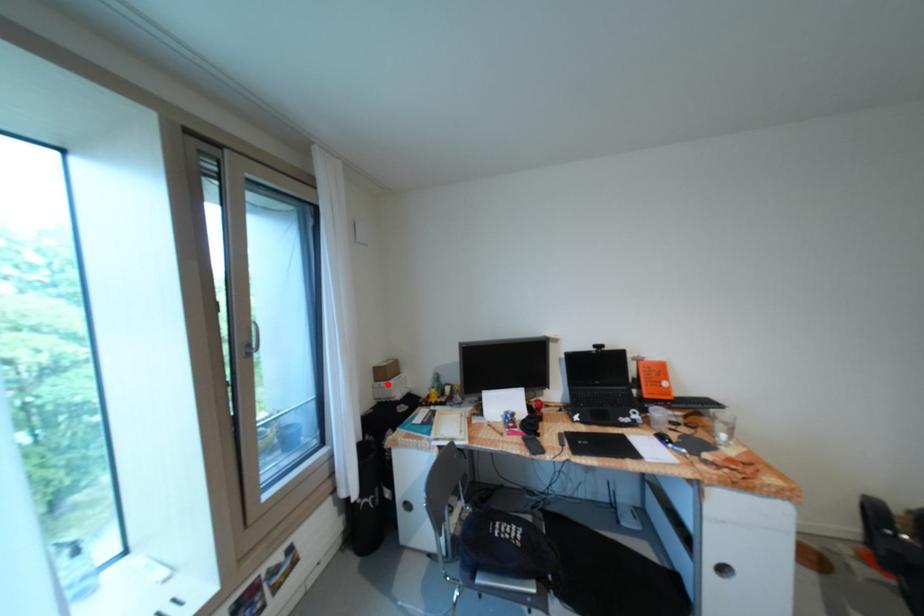
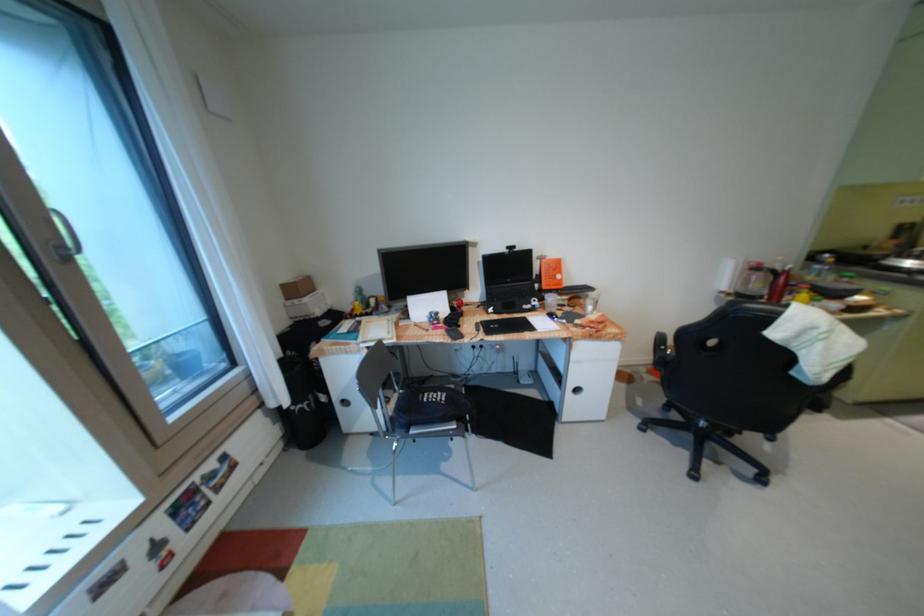
Where in the second image is the point corresponding to the highlighted location from the first image?

(300, 302)